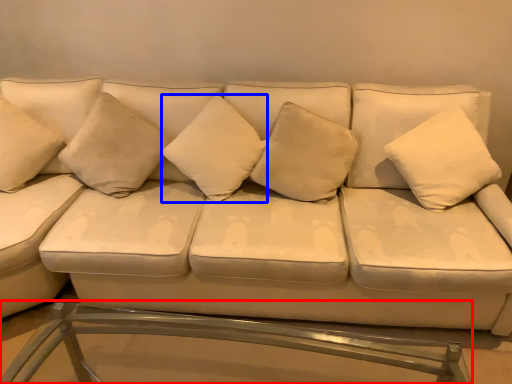
Question: Which object is closer to the camera taking this photo, table (highlighted by a red box) or pillow (highlighted by a blue box)?

Choices:
 (A) table
 (B) pillow

Answer: (A)